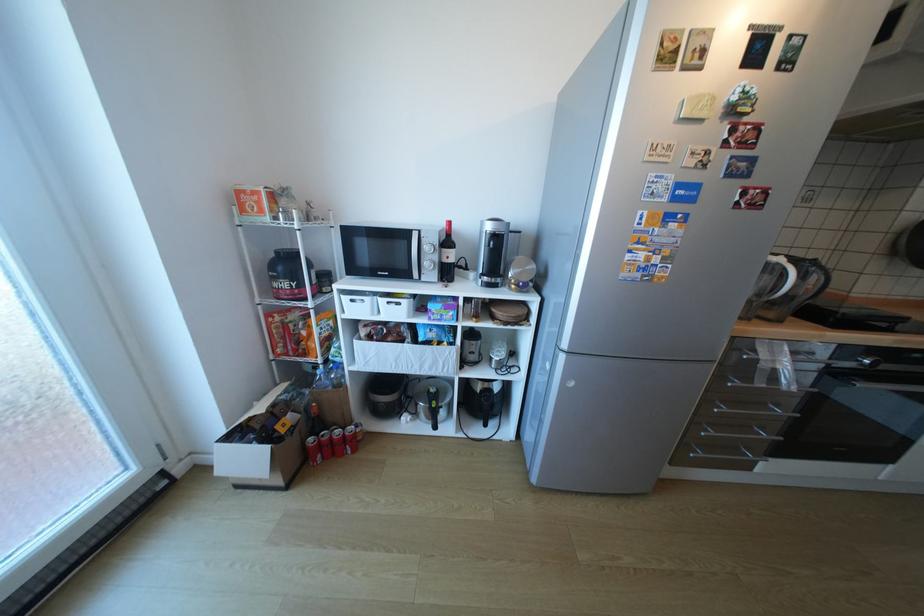
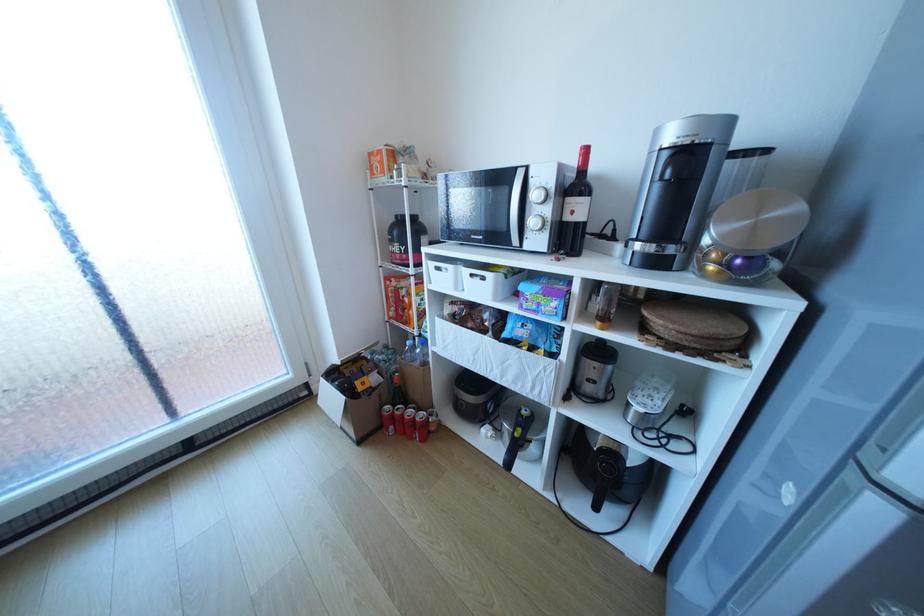
Find the pixel in the second image that matches pixel 302 390 in the first image.

(402, 354)